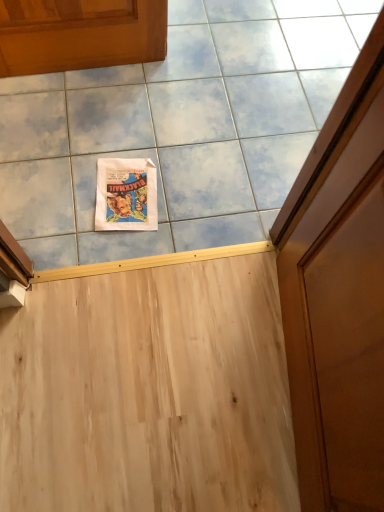
The width and height of the screenshot is (384, 512). What are the coordinates of `matte paper comic book at upper center` in the screenshot? It's located at (126, 195).

The height and width of the screenshot is (512, 384). What do you see at coordinates (126, 195) in the screenshot?
I see `matte paper comic book at upper center` at bounding box center [126, 195].

The height and width of the screenshot is (512, 384). What do you see at coordinates (179, 128) in the screenshot?
I see `white paper poster at upper center` at bounding box center [179, 128].

The image size is (384, 512). In order to click on white paper poster at upper center in this screenshot , I will do `click(179, 128)`.

What is the approximate width of white paper poster at upper center?

The width of white paper poster at upper center is 6.34 feet.

Where is `matte paper comic book at upper center`? matte paper comic book at upper center is located at coordinates (126, 195).

Considering the relative positions of white paper poster at upper center and matte paper comic book at upper center in the image provided, is white paper poster at upper center to the right of matte paper comic book at upper center from the viewer's perspective?

Yes, white paper poster at upper center is to the right of matte paper comic book at upper center.

Is white paper poster at upper center positioned behind matte paper comic book at upper center?

No, the depth of white paper poster at upper center is less than that of matte paper comic book at upper center.

Which is closer to the camera, [152,159] or [119,217]?

The point [119,217] is more forward.

From the picture: From the image's perspective, is white paper poster at upper center positioned above or below matte paper comic book at upper center?

white paper poster at upper center is above matte paper comic book at upper center.

From a real-world perspective, is white paper poster at upper center over matte paper comic book at upper center?

Yes, from a real-world perspective, white paper poster at upper center is over matte paper comic book at upper center

Considering the sizes of white paper poster at upper center and matte paper comic book at upper center in the image, is white paper poster at upper center wider or thinner than matte paper comic book at upper center?

Clearly, white paper poster at upper center has more width compared to matte paper comic book at upper center.

Consider the image. Is white paper poster at upper center taller than matte paper comic book at upper center?

Incorrect, the height of white paper poster at upper center is not larger of that of matte paper comic book at upper center.

Can you confirm if white paper poster at upper center is smaller than matte paper comic book at upper center?

Incorrect, white paper poster at upper center is not smaller in size than matte paper comic book at upper center.

Is white paper poster at upper center completely or partially outside of matte paper comic book at upper center?

Yes.

Is white paper poster at upper center touching matte paper comic book at upper center?

white paper poster at upper center and matte paper comic book at upper center are clearly separated.

Is white paper poster at upper center turned away from matte paper comic book at upper center?

No, white paper poster at upper center's orientation is not away from matte paper comic book at upper center.

How many degrees apart are the facing directions of white paper poster at upper center and matte paper comic book at upper center?

The angle between the facing direction of white paper poster at upper center and the facing direction of matte paper comic book at upper center is 6.12 degrees.

How much distance is there between white paper poster at upper center and matte paper comic book at upper center?

white paper poster at upper center and matte paper comic book at upper center are 13.32 inches apart from each other.

In the image, there is a matte paper comic book at upper center. Where is `ceramic tile above it (from the image's perspective)`? Image resolution: width=384 pixels, height=512 pixels. ceramic tile above it (from the image's perspective) is located at coordinates [x=179, y=128].

Considering the relative positions of matte paper comic book at upper center and white paper poster at upper center in the image provided, is matte paper comic book at upper center to the right of white paper poster at upper center from the viewer's perspective?

Incorrect, matte paper comic book at upper center is not on the right side of white paper poster at upper center.

Is matte paper comic book at upper center closer to camera compared to white paper poster at upper center?

No, matte paper comic book at upper center is further to the viewer.

Which is more distant, [98,190] or [311,46]?

Point [311,46]

From the image's perspective, which is below, matte paper comic book at upper center or white paper poster at upper center?

matte paper comic book at upper center, from the image's perspective.

From a real-world perspective, who is located higher, matte paper comic book at upper center or white paper poster at upper center?

In real-world perspective, white paper poster at upper center is above.

Considering the sizes of objects matte paper comic book at upper center and white paper poster at upper center in the image provided, who is wider, matte paper comic book at upper center or white paper poster at upper center?

white paper poster at upper center is wider.

Who is shorter, matte paper comic book at upper center or white paper poster at upper center?

With less height is white paper poster at upper center.

Can you confirm if matte paper comic book at upper center is smaller than white paper poster at upper center?

Correct, matte paper comic book at upper center occupies less space than white paper poster at upper center.

Is matte paper comic book at upper center positioned beyond the bounds of white paper poster at upper center?

Absolutely, matte paper comic book at upper center is external to white paper poster at upper center.

Is matte paper comic book at upper center not close to white paper poster at upper center?

That's not correct — matte paper comic book at upper center is a little close to white paper poster at upper center.

Is matte paper comic book at upper center looking in the opposite direction of white paper poster at upper center?

matte paper comic book at upper center does not have its back to white paper poster at upper center.

How different are the orientations of matte paper comic book at upper center and white paper poster at upper center in degrees?

6.12 degrees.

Measure the distance from matte paper comic book at upper center to white paper poster at upper center.

matte paper comic book at upper center is 13.32 inches away from white paper poster at upper center.

In order to click on comic book behind the white paper poster at upper center in this screenshot , I will do `click(126, 195)`.

Identify the location of comic book below the white paper poster at upper center (from a real-world perspective). (126, 195).

This screenshot has height=512, width=384. What are the coordinates of `ceramic tile that is above the matte paper comic book at upper center (from the image's perspective)` in the screenshot? It's located at (179, 128).